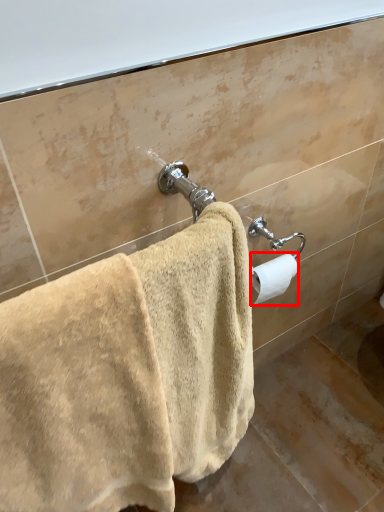
Question: From the image's perspective, where is toilet paper (annotated by the red box) located in relation to towel in the image?

Choices:
 (A) above
 (B) below

Answer: (A)